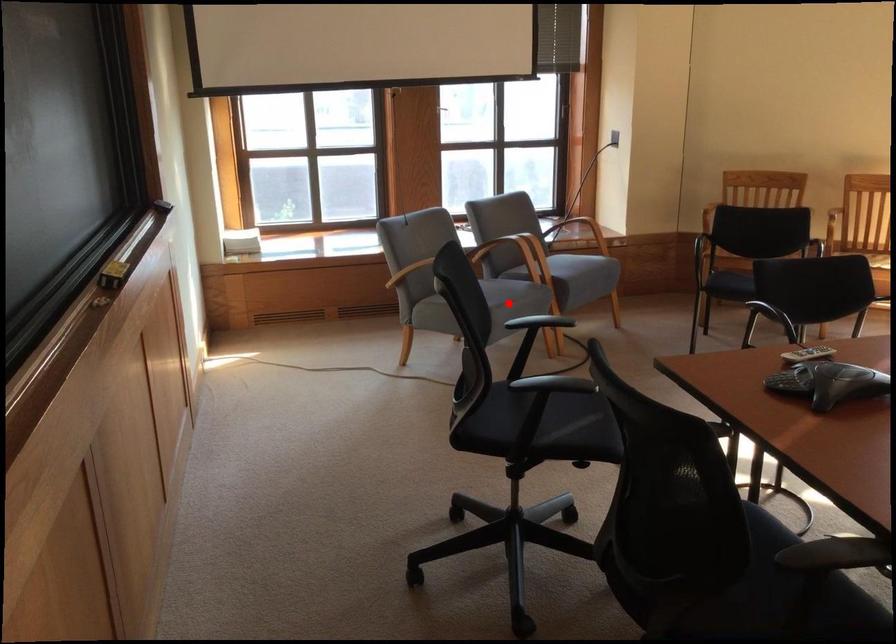
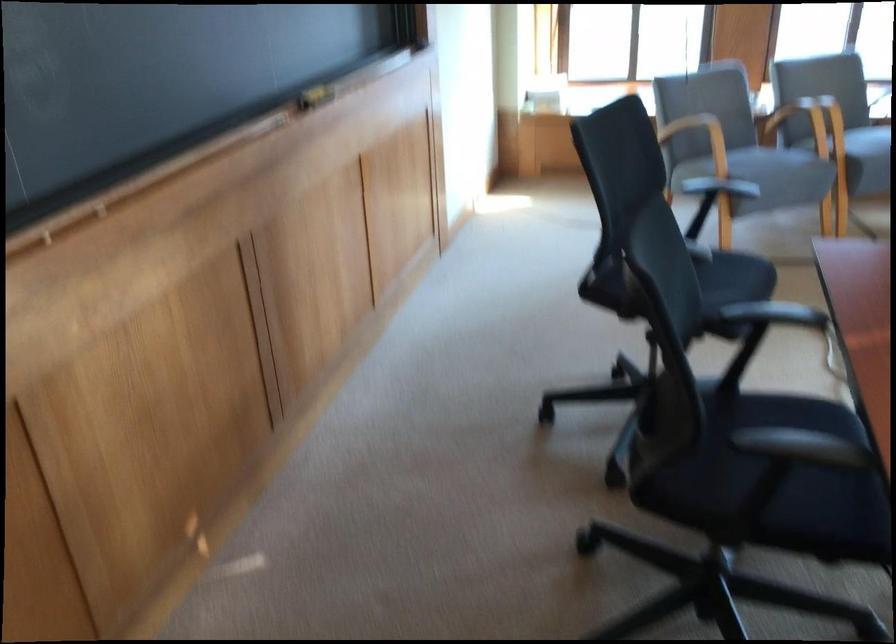
In the second image, find the point that corresponds to the highlighted location in the first image.

(769, 172)